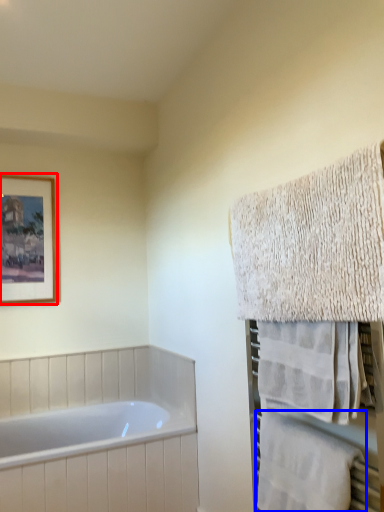
Question: Which object is closer to the camera taking this photo, picture frame (highlighted by a red box) or towel (highlighted by a blue box)?

Choices:
 (A) picture frame
 (B) towel

Answer: (B)